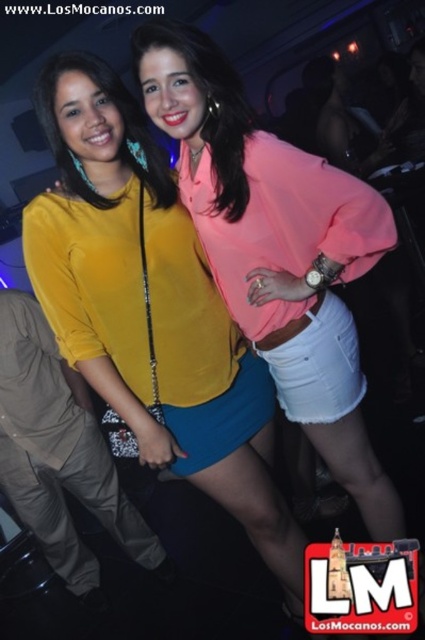
You are organizing a clothing display and need to place the matte yellow blouse at center and the pink satin blouse at center on a mannequin. Which blouse should you place first if you want the larger one to be on top?

The matte yellow blouse at center is larger than the pink satin blouse at center, so you should place the matte yellow blouse at center first to have it on top.